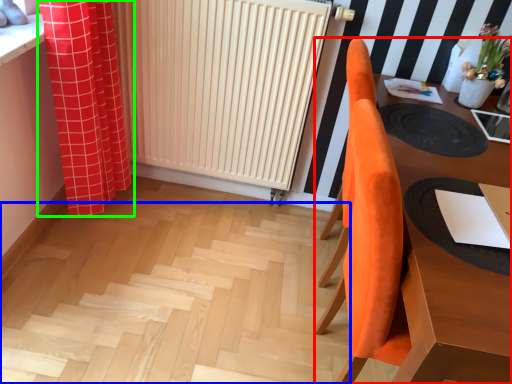
Question: Estimate the real-world distances between objects in this image. Which object is closer to furniture (highlighted by a red box), stairs (highlighted by a blue box) or curtain (highlighted by a green box)?

Choices:
 (A) stairs
 (B) curtain

Answer: (A)